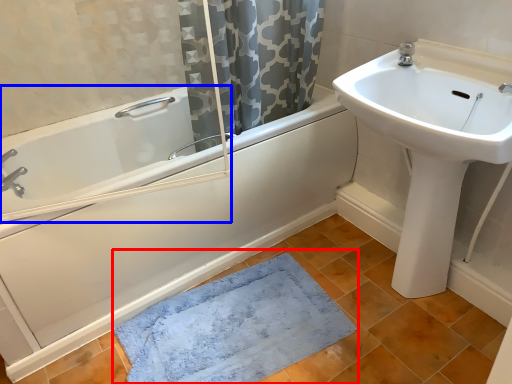
Question: Which object is closer to the camera taking this photo, bath mat (highlighted by a red box) or bath (highlighted by a blue box)?

Choices:
 (A) bath mat
 (B) bath

Answer: (B)